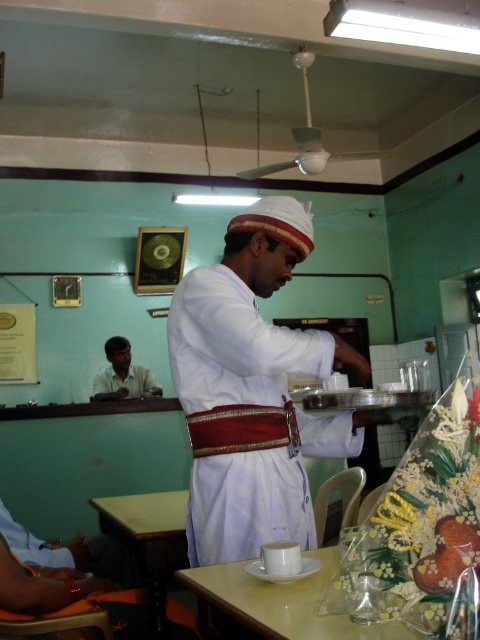
Question: Which object is closer to the camera taking this photo?

Choices:
 (A) smooth brown pastry at center
 (B) wooden table at lower left
 (C) matte white shirt at lower left
 (D) white glossy table at lower center

Answer: (A)

Question: Is the position of wooden table at lower left less distant than that of matte white shirt at lower left?

Choices:
 (A) no
 (B) yes

Answer: (B)

Question: Considering the relative positions of white matte robe at center and matte white shirt at lower left in the image provided, where is white matte robe at center located with respect to matte white shirt at lower left?

Choices:
 (A) left
 (B) right

Answer: (B)

Question: Which of the following is the closest to the observer?

Choices:
 (A) smooth brown pastry at center
 (B) white matte robe at center
 (C) matte white shirt at lower left
 (D) white glossy table at lower center

Answer: (A)

Question: Which object is positioned farthest from the matte white shirt at lower left?

Choices:
 (A) wooden table at lower left
 (B) smooth brown pastry at center
 (C) white matte robe at center
 (D) white glossy table at lower center

Answer: (B)

Question: Does white matte robe at center appear on the left side of smooth brown pastry at center?

Choices:
 (A) yes
 (B) no

Answer: (A)